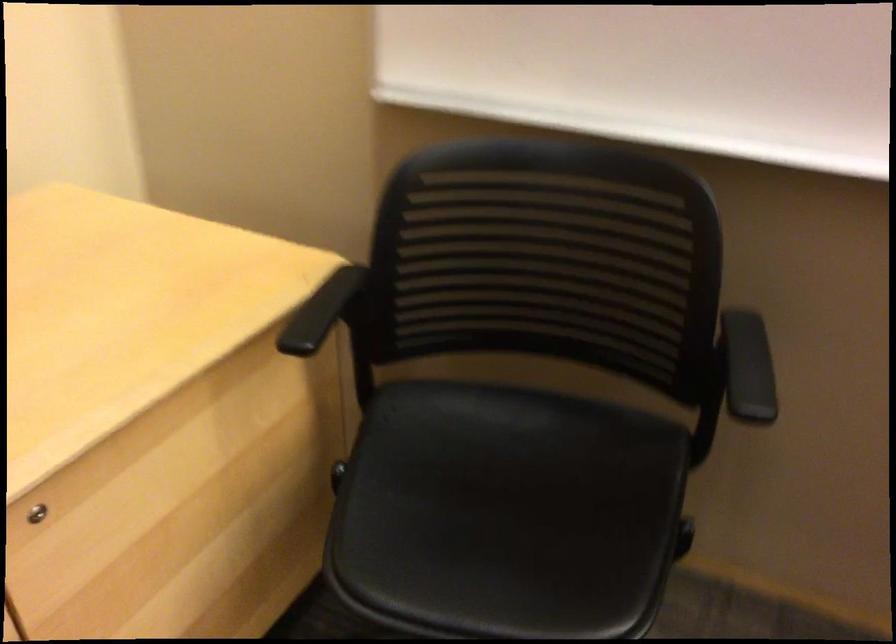
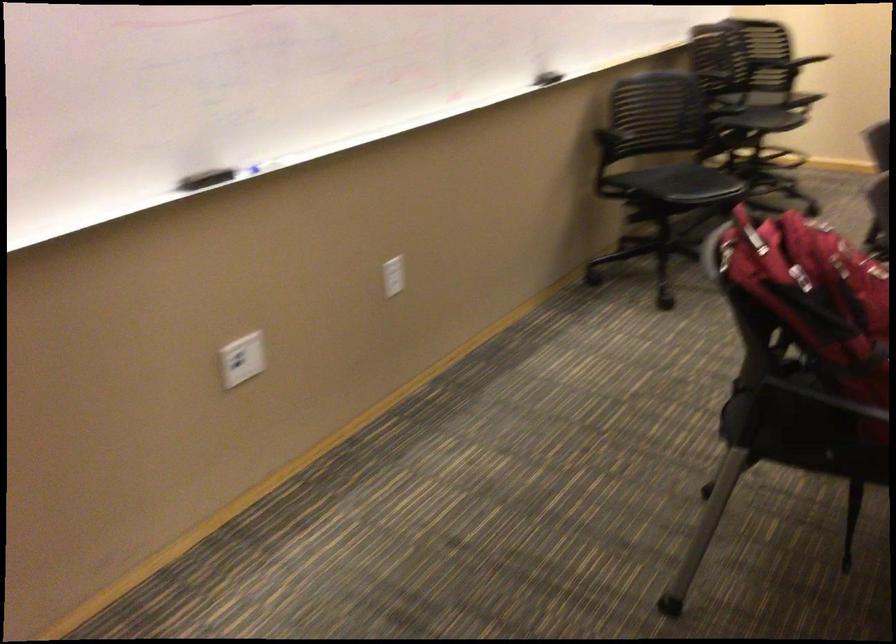
The first image is from the beginning of the video and the second image is from the end. How did the camera likely rotate when shooting the video?

The camera rotated toward right-down.